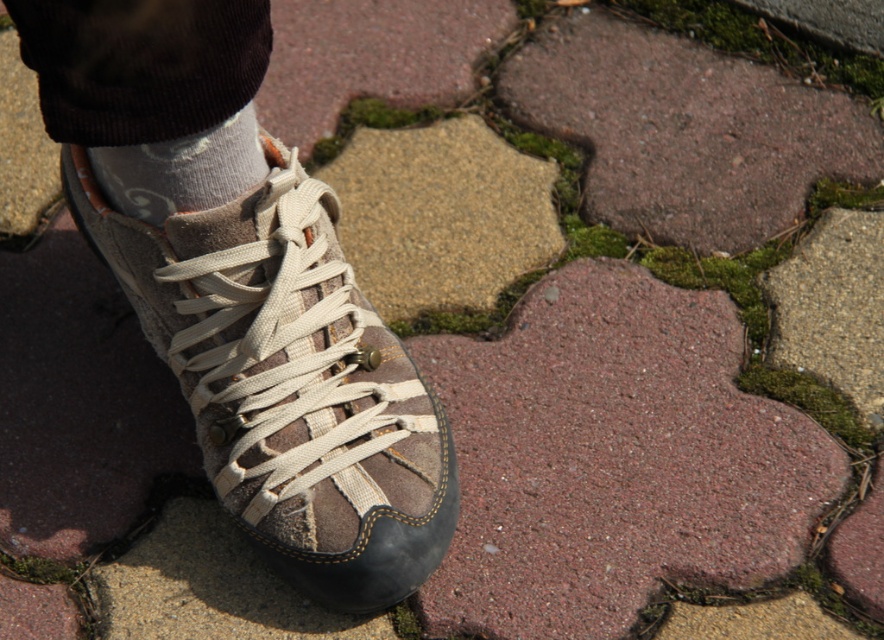
Question: Among these points, which one is nearest to the camera?

Choices:
 (A) (105, 150)
 (B) (208, 220)

Answer: (A)

Question: Does brown suede boot at center lie in front of gray floral-patterned sock at upper left?

Choices:
 (A) yes
 (B) no

Answer: (B)

Question: Where is brown suede boot at center located in relation to gray floral-patterned sock at upper left in the image?

Choices:
 (A) above
 (B) below

Answer: (B)

Question: Which point is closer to the camera?

Choices:
 (A) (269, 257)
 (B) (104, 154)

Answer: (B)

Question: Which of the following is the closest to the observer?

Choices:
 (A) brown suede boot at center
 (B) gray floral-patterned sock at upper left

Answer: (B)

Question: Can you confirm if brown suede boot at center is positioned to the left of gray floral-patterned sock at upper left?

Choices:
 (A) yes
 (B) no

Answer: (B)